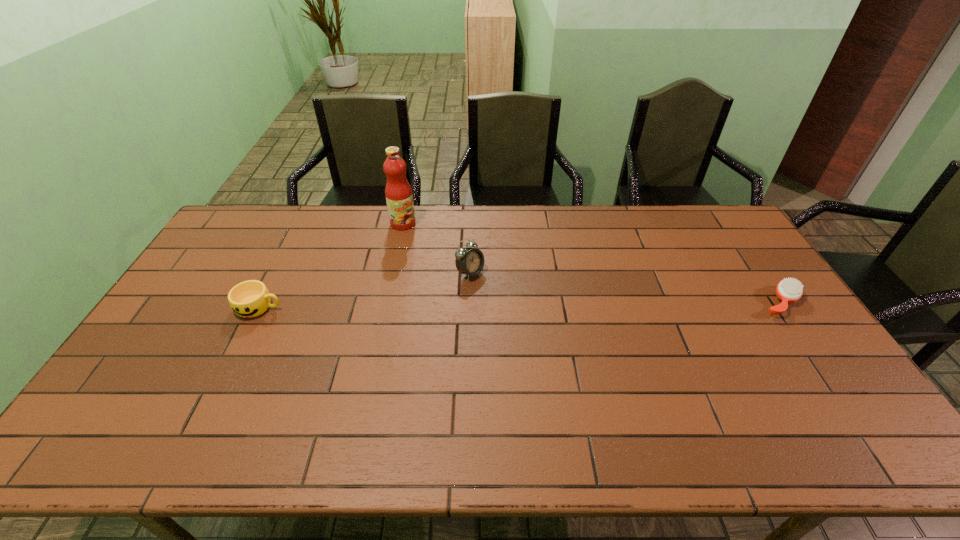
Where is `free space located on the front label of the farthest object`? This screenshot has width=960, height=540. free space located on the front label of the farthest object is located at coordinates (425, 246).

Where is `free space located on the front label of the farthest object`? The width and height of the screenshot is (960, 540). free space located on the front label of the farthest object is located at coordinates (458, 280).

Image resolution: width=960 pixels, height=540 pixels. What are the coordinates of `vacant space located 0.290m on the front label of the farthest object` in the screenshot? It's located at (451, 273).

The width and height of the screenshot is (960, 540). Identify the location of vacant space located 0.350m on the face of the alarm clock. (573, 335).

Where is `vacant space located on the face of the alarm clock`? This screenshot has height=540, width=960. vacant space located on the face of the alarm clock is located at coordinates (510, 296).

In order to click on vacant point located 0.140m on the face of the alarm clock in this screenshot , I will do `click(515, 300)`.

Where is `object present at the far edge`? The width and height of the screenshot is (960, 540). object present at the far edge is located at coordinates (398, 192).

Where is `object that is at the right edge`? This screenshot has width=960, height=540. object that is at the right edge is located at coordinates (788, 290).

Image resolution: width=960 pixels, height=540 pixels. I want to click on free spot at the far edge of the desktop, so [x=392, y=230].

Where is `vacant area at the near edge`? The image size is (960, 540). vacant area at the near edge is located at coordinates (588, 413).